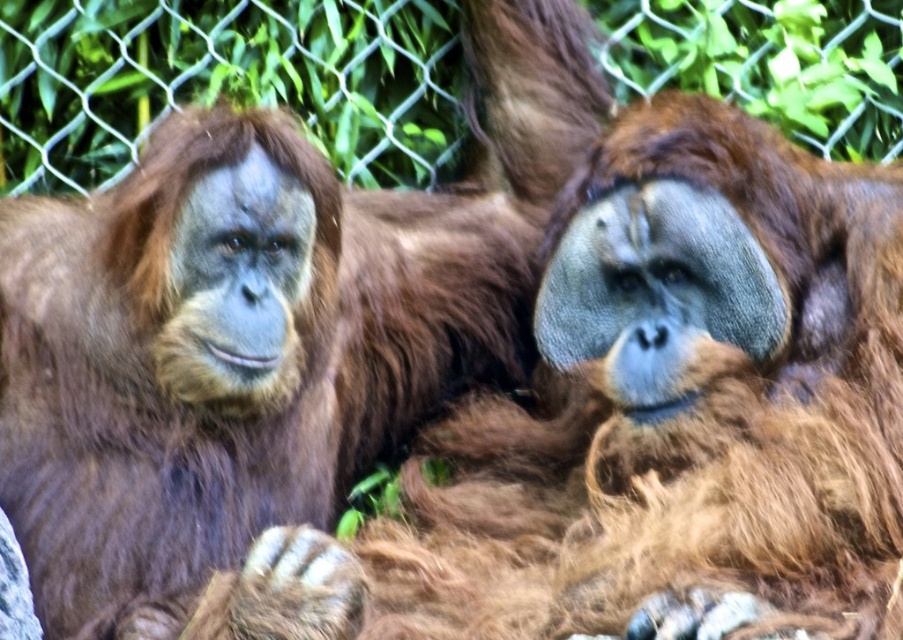
Does brown furry orangutan at center come in front of wire mesh fence at upper center?

Yes, brown furry orangutan at center is in front of wire mesh fence at upper center.

Who is lower down, brown furry orangutan at center or wire mesh fence at upper center?

brown furry orangutan at center is lower down.

The image size is (903, 640). What are the coordinates of `brown furry orangutan at center` in the screenshot? It's located at (262, 324).

I want to click on brown furry orangutan at center, so click(x=262, y=324).